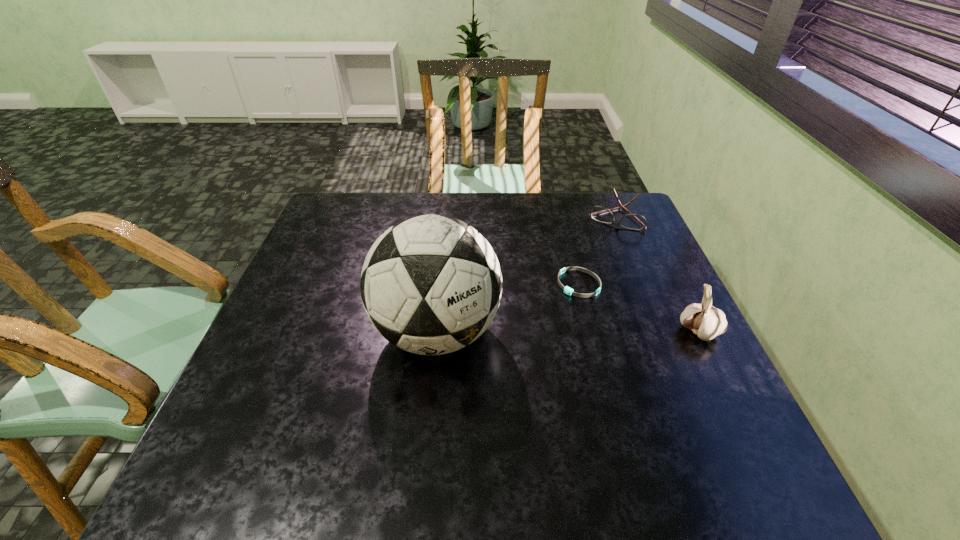
The image size is (960, 540). I want to click on unoccupied area between the garlic and the farthest object, so click(657, 274).

You are a GUI agent. You are given a task and a screenshot of the screen. Output one action in this format:
    pyautogui.click(x=<x>, y=<y>)
    Task: Click on the blank region between the spectacles and the leftmost object
    The image size is (960, 540).
    Given the screenshot: What is the action you would take?
    pyautogui.click(x=526, y=274)

The image size is (960, 540). I want to click on the closest object to the second tallest object, so click(x=567, y=290).

Identify which object is the second nearest to the soccer ball. Please provide its 2D coordinates. Your answer should be formatted as a tuple, i.e. [(x, y)], where the tuple contains the x and y coordinates of a point satisfying the conditions above.

[(600, 214)]